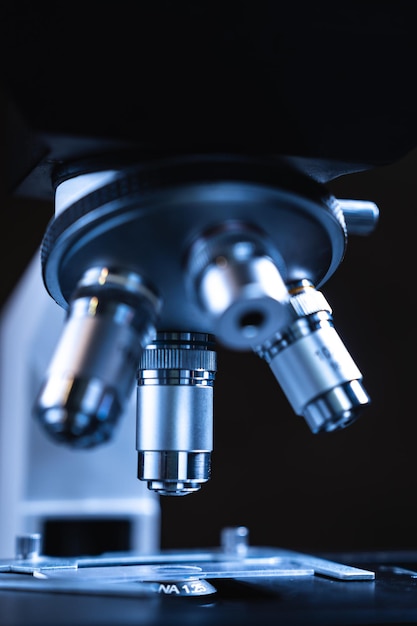
At what (x,y) coordinates should I click in order to perform the action: click on light reflections. Please return your answer as a coordinate pair (x, y). The height and width of the screenshot is (626, 417). Looking at the image, I should click on (218, 285), (93, 274).